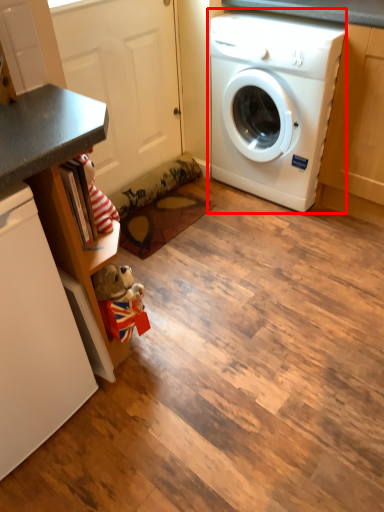
Question: From the image's perspective, what is the correct spatial relationship of washing machine (annotated by the red box) in relation to dish washer?

Choices:
 (A) below
 (B) above

Answer: (B)